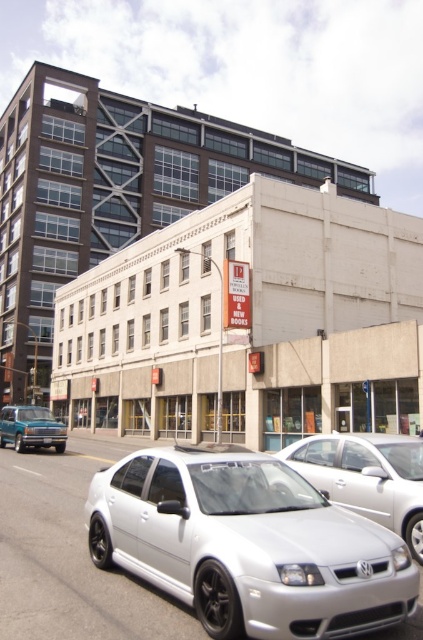
Locate an element on the screen. silver metallic car at center is located at coordinates (247, 545).

Identify the location of silver metallic car at center. The image size is (423, 640). (247, 545).

Can you confirm if silver metallic sedan at center is taller than teal metallic truck at lower left?

In fact, silver metallic sedan at center may be shorter than teal metallic truck at lower left.

Between silver metallic sedan at center and teal metallic truck at lower left, which one is positioned lower?

Positioned lower is teal metallic truck at lower left.

Does point (365, 509) come in front of point (13, 417)?

That is True.

The image size is (423, 640). Find the location of `silver metallic sedan at center`. silver metallic sedan at center is located at coordinates (367, 477).

Does silver metallic sedan at center appear under black plastic license plate at center?

No.

Between silver metallic sedan at center and black plastic license plate at center, which one appears on the right side from the viewer's perspective?

Positioned to the right is silver metallic sedan at center.

Is point (406, 465) positioned before point (44, 440)?

Yes.

Find the location of a particular element. The width and height of the screenshot is (423, 640). silver metallic sedan at center is located at coordinates (367, 477).